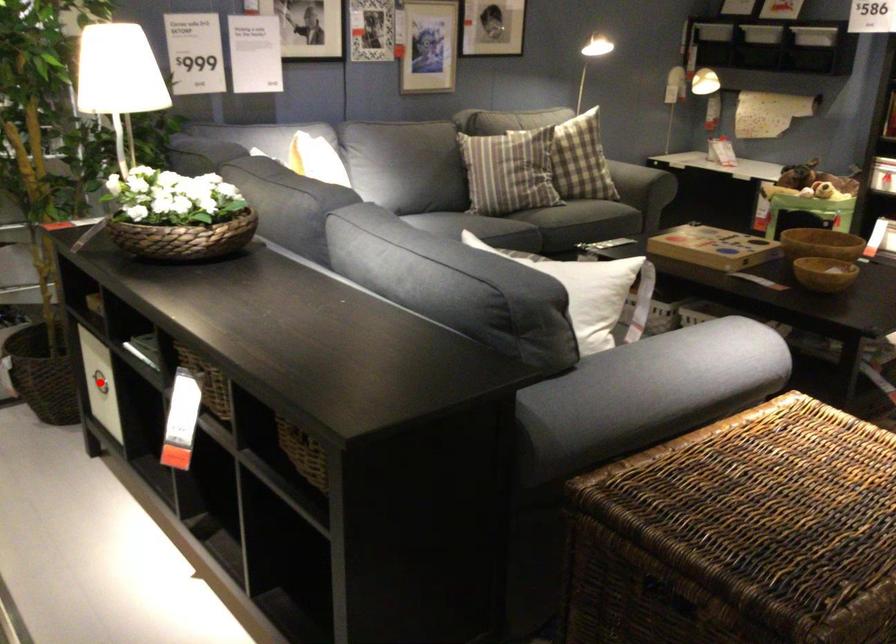
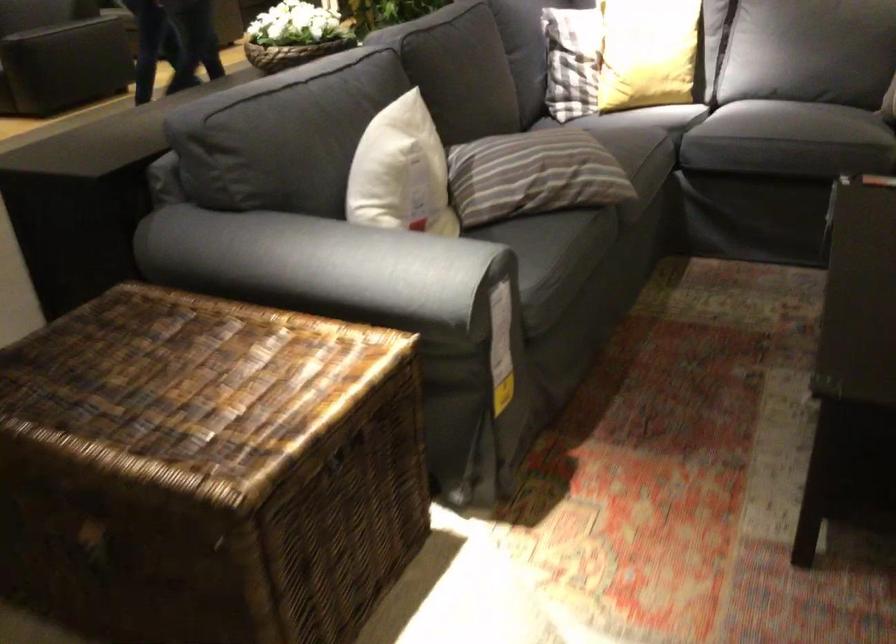
Question: I am providing you with two images of the same scene from different viewpoints. A red point is marked on the first image. At the location where the point appears in image 1, is it still visible in image 2?

Choices:
 (A) Yes
 (B) No

Answer: (B)